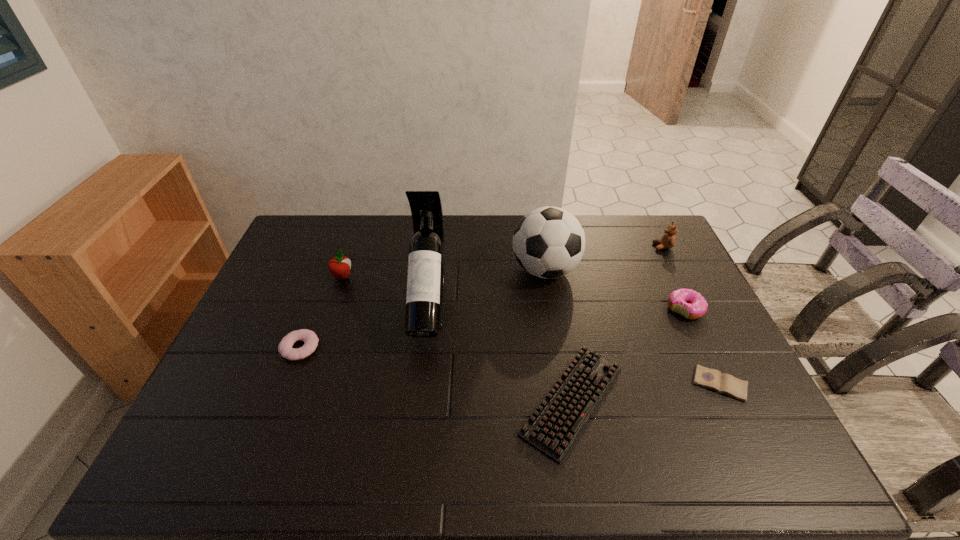
The image size is (960, 540). Identify the location of free space located on the left of the shortest object. (582, 384).

Identify the location of soccer ball situated at the far edge. (549, 242).

The image size is (960, 540). In order to click on teddy bear that is at the far edge in this screenshot , I will do `click(668, 240)`.

You are a GUI agent. You are given a task and a screenshot of the screen. Output one action in this format:
    pyautogui.click(x=<x>, y=<y>)
    Task: Click on the object located in the near edge section of the desktop
    The image size is (960, 540).
    Given the screenshot: What is the action you would take?
    pyautogui.click(x=553, y=427)

Find the location of a particular element. The image size is (960, 540). object that is at the left edge is located at coordinates (310, 339).

Identify the location of teddy bear positioned at the right edge. The image size is (960, 540). (668, 240).

Where is `doughnut that is at the right edge`? The height and width of the screenshot is (540, 960). doughnut that is at the right edge is located at coordinates (692, 305).

Find the location of a particular element. diary that is at the right edge is located at coordinates (713, 379).

Image resolution: width=960 pixels, height=540 pixels. I want to click on object located at the far right corner, so click(x=668, y=240).

At what (x,y) coordinates should I click in order to perform the action: click on vacant area at the far edge of the desktop. Please return your answer as a coordinate pair (x, y). The width and height of the screenshot is (960, 540). Looking at the image, I should click on (457, 218).